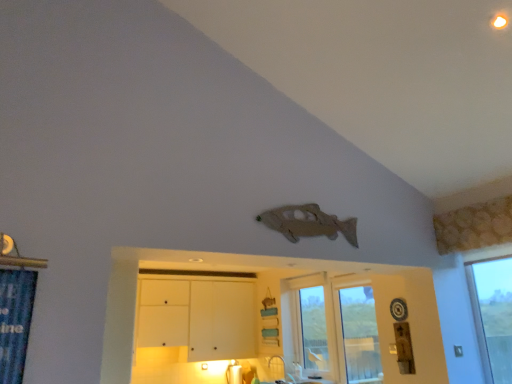
Question: Considering the relative positions of blue fabric shower curtain at left and matte gray fish at upper center in the image provided, is blue fabric shower curtain at left to the left or to the right of matte gray fish at upper center?

Choices:
 (A) left
 (B) right

Answer: (A)

Question: Is blue fabric shower curtain at left spatially inside matte gray fish at upper center, or outside of it?

Choices:
 (A) outside
 (B) inside

Answer: (A)

Question: Which is farther from the matte gray fish at upper center?

Choices:
 (A) wooden fish at upper center, marked as the second dresser in a back-to-front arrangement
 (B) transparent glass door at center, the 2th window from the back
 (C) transparent glass window at center, acting as the second window starting from the front
 (D) white matte cabinet at lower center, positioned as the 2th dresser in front-to-back order
 (E) blue fabric shower curtain at left

Answer: (D)

Question: Which object is positioned farthest from the transparent glass window at center, acting as the second window starting from the front?

Choices:
 (A) blue fabric shower curtain at left
 (B) matte gray fish at upper center
 (C) white matte cabinet at lower center, which is counted as the 1th dresser, starting from the back
 (D) wooden fish at upper center, which is the first dresser from front to back
 (E) transparent glass door at center, which is the first window in front-to-back order

Answer: (A)